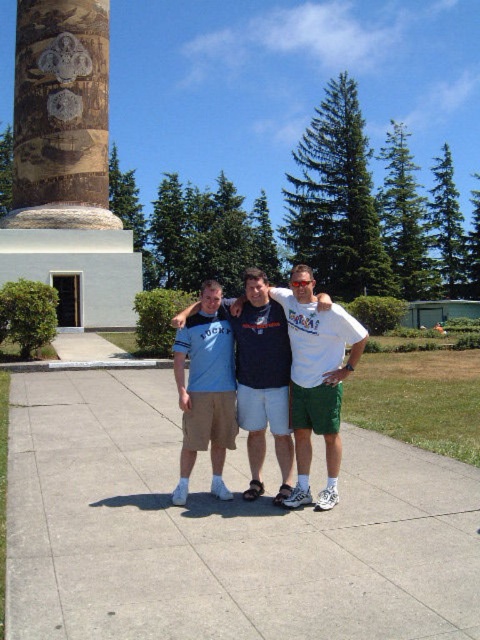
Looking at this image, you are a photographer setting up for a group photo. You have a blue cotton shirt at center and concrete at center in your frame. Which object is closer to the camera?

The blue cotton shirt at center is closer to the camera because the concrete at center is positioned under it.

You are standing on the paved area and want to place a small potted plant between the concrete at center and the blue cotton shirt at center. Based on their positions, where should you place the plant to ensure it is between them?

The concrete at center is in front of the blue cotton shirt at center, so you should place the plant in front of the blue cotton shirt at center but behind the concrete at center to position it between them.